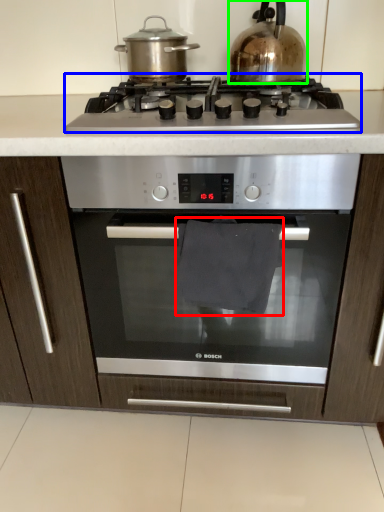
Question: Which is farther away from material (highlighted by a red box)? gas stove (highlighted by a blue box) or kitchen appliance (highlighted by a green box)?

Choices:
 (A) gas stove
 (B) kitchen appliance

Answer: (B)